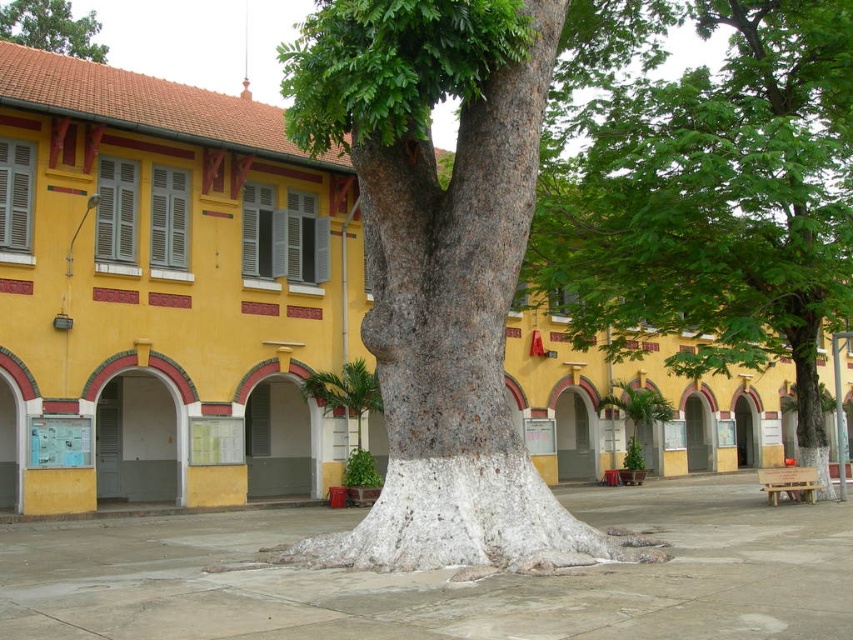
You are standing in the garden looking at the green leafy tree at center and the green rough bark tree at upper center. Which tree is closer to you?

The green leafy tree at center is closer to you because it is positioned under the green rough bark tree at upper center, meaning the latter is further away.

Based on the photo, you are a gardener planning to plant a new tree in the yard. You observe the smooth bark tree at center and the green leafy tree at center in the image. Which tree has a wider trunk?

The smooth bark tree at center has a wider trunk than the green leafy tree at center, as its width surpasses the latter.